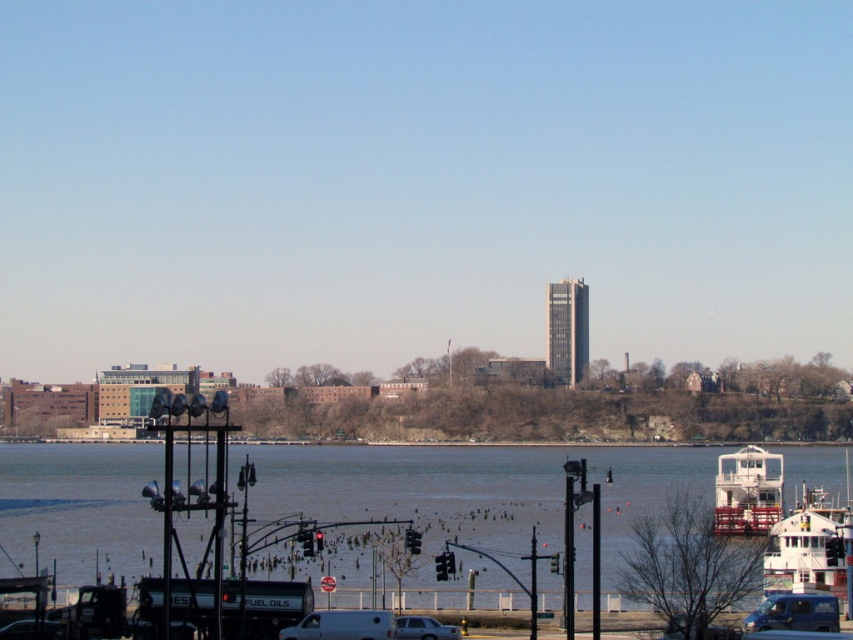
You are standing at the edge of the waterfront area and want to locate the brown water at center. According to the coordinates provided, where exactly should you look?

The brown water at center is located at point coordinates 0.769 on the x axis and 0.491 on the y axis.

You are a delivery driver who needs to park your vehicle in this area. You have a fuel truck that is 30 feet long. The parking lot here has spaces that are 25 feet wide. Is there enough space between the brown water at center and the blue metallic van at lower right to park your truck?

The distance between the brown water at center and the blue metallic van at lower right is 269.51 feet. Since the parking spaces are only 25 feet wide, there is more than enough space to park the 30 feet long fuel truck between them.